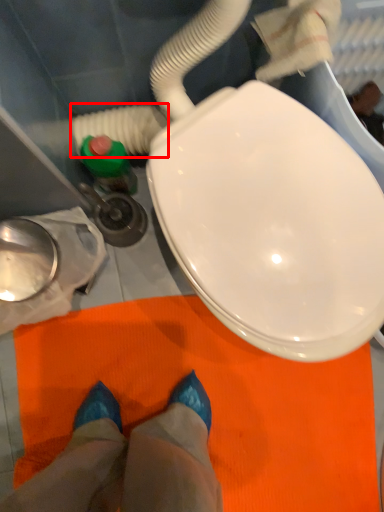
Question: From the image, what is the correct spatial relationship of water pipe (annotated by the red box) in relation to person?

Choices:
 (A) right
 (B) left

Answer: (B)